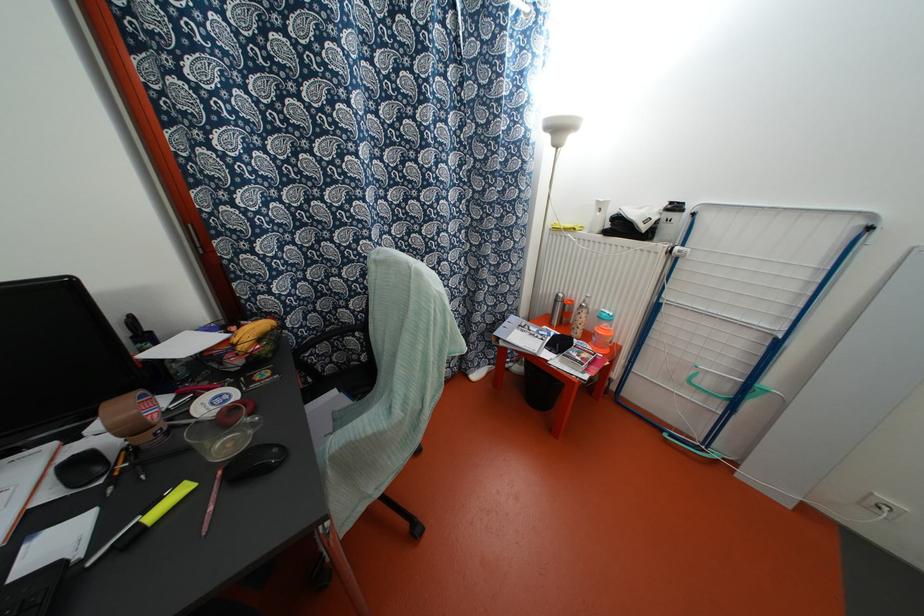
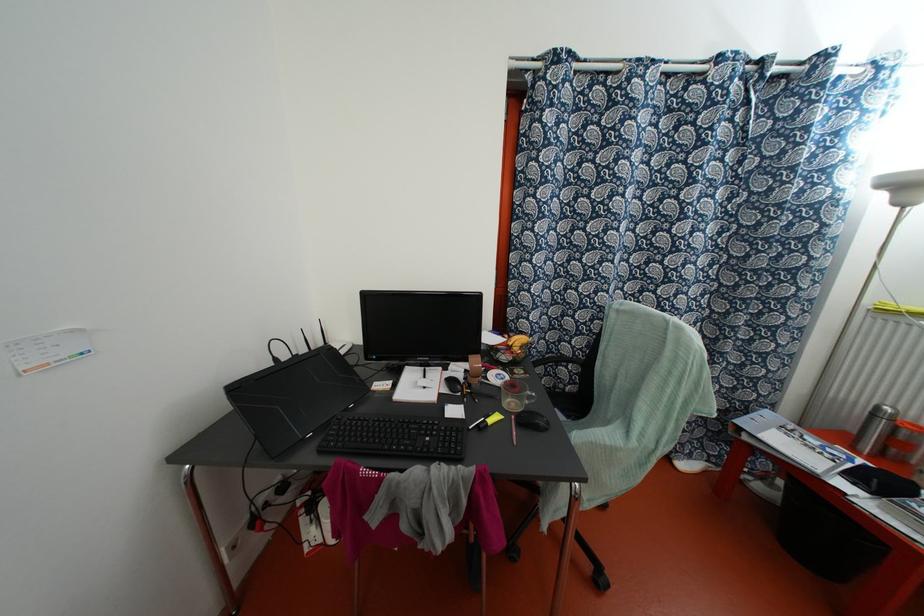
Where in the second image is the point corresponding to (x=554, y=301) from the first image?

(872, 415)